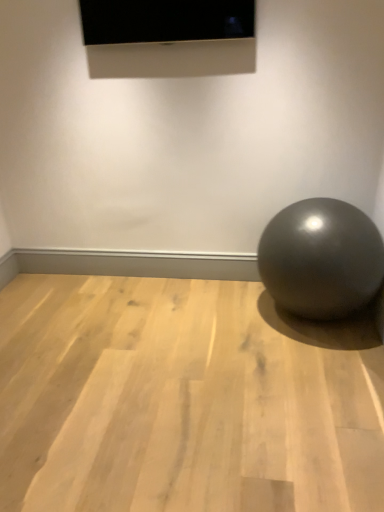
You are a GUI agent. You are given a task and a screenshot of the screen. Output one action in this format:
    pyautogui.click(x=<x>, y=<y>)
    Task: Click on the free space below matte black screen at upper center (from a real-world perspective)
    The height and width of the screenshot is (512, 384).
    Given the screenshot: What is the action you would take?
    pyautogui.click(x=189, y=275)